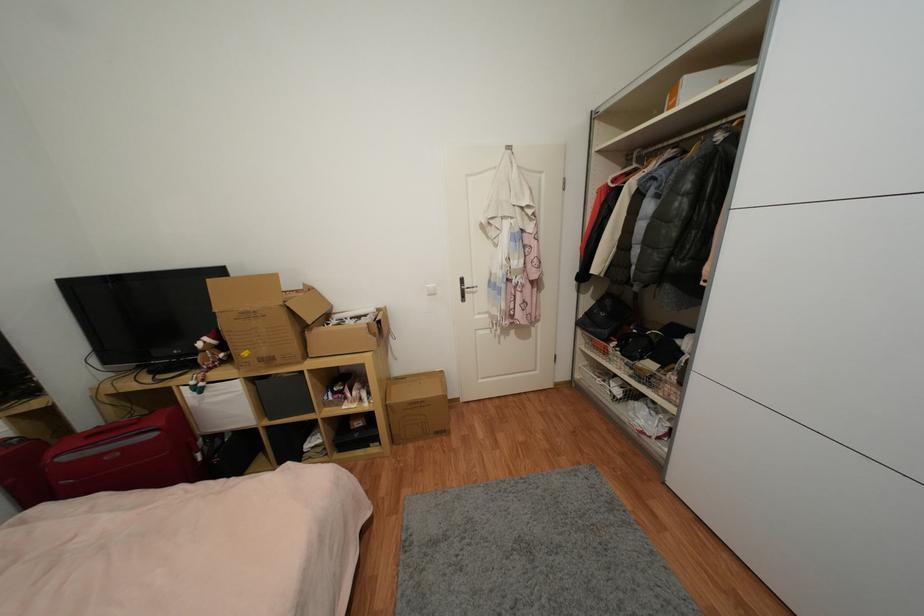
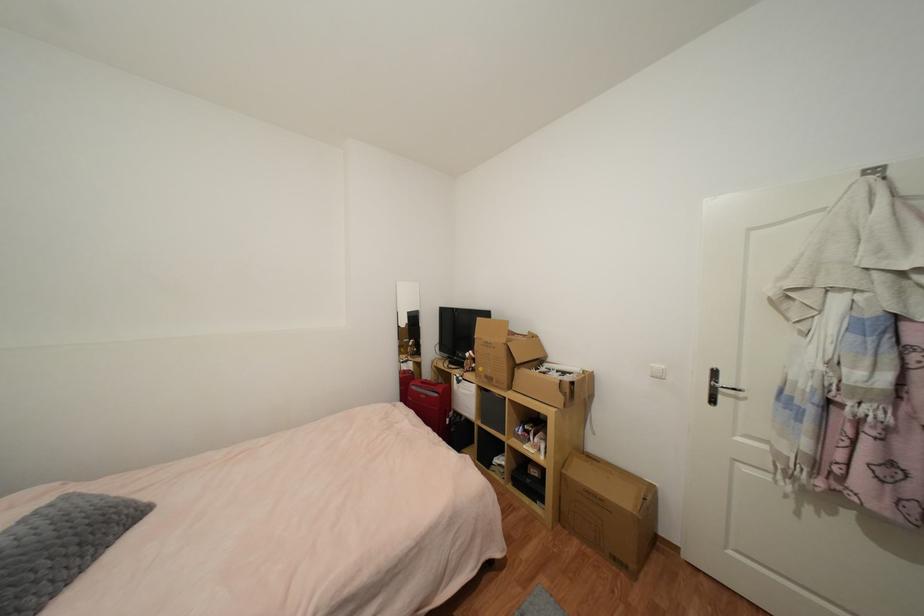
The point at (397, 440) is marked in the first image. Where is the corresponding point in the second image?

(564, 517)